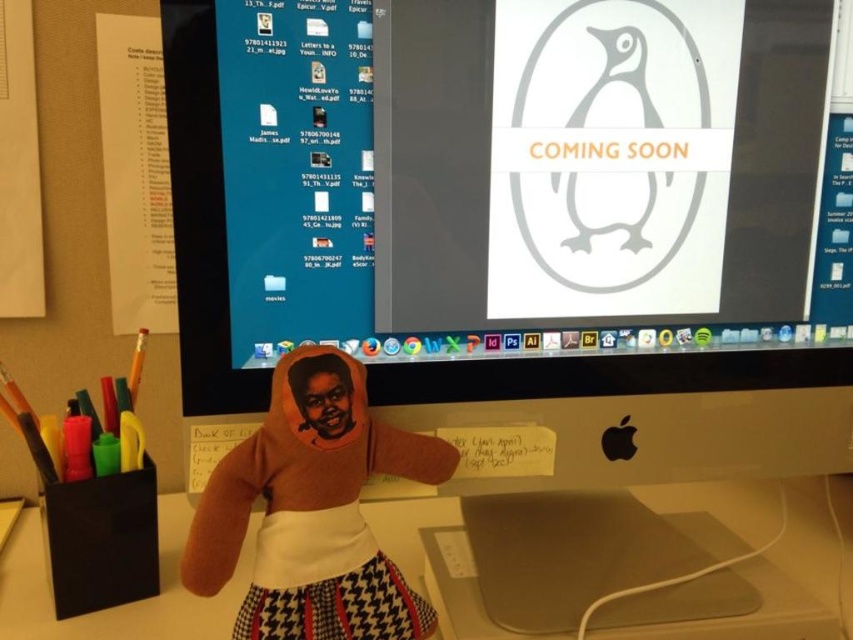
You are setting up a new workspace and want to place both the brown plush doll at center and the white plastic computer desk at center. Given their sizes, which one can fit on a standard 1.2 meter wide desk without exceeding its width?

The brown plush doll at center has a smaller width than the white plastic computer desk at center. Since the desk is 1.2 meters wide, the brown plush doll at center will fit, but the white plastic computer desk at center might not fit if its width exceeds 1.2 meters. However, the description only states the doll is narrower, so the doll definitely fits. The desk may or may not fit depending on its exact width.

You are organizing a desk and see the brown plush doll at center and the white plastic computer desk at center. Which object is positioned higher?

The brown plush doll at center is located above the white plastic computer desk at center, so it is positioned higher.